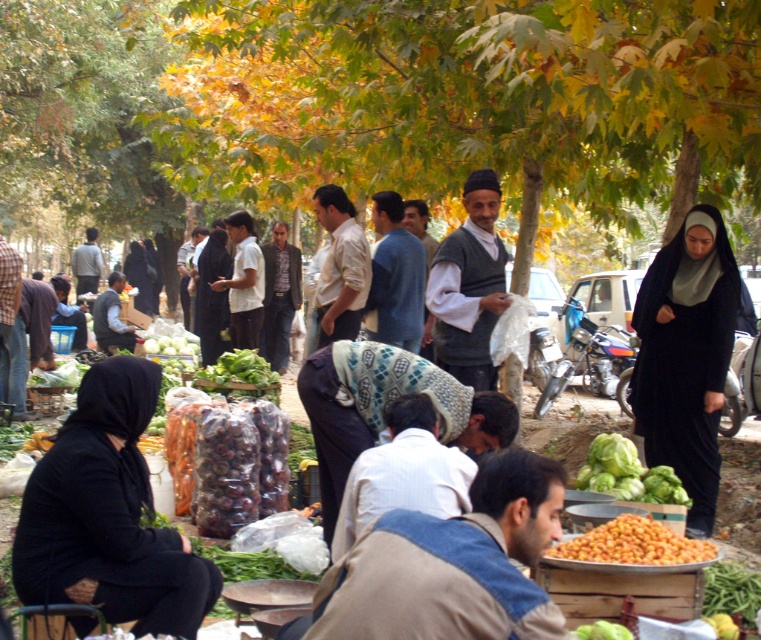
You are a customer at the market and want to buy both the orange matte fruit at lower right and the green leafy at center. Which of these two items is taller?

The orange matte fruit at lower right is not as tall as the green leafy at center, so the green leafy at center is taller.

Looking at this image, you are a customer at the market and want to buy the orange matte fruit at lower right and the green leafy at center. Which one is smaller in size?

The orange matte fruit at lower right has a smaller size compared to the green leafy at center, so the orange matte fruit at lower right is smaller.